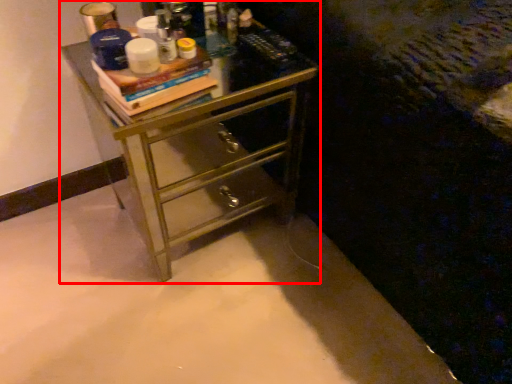
Question: From the image's perspective, considering the relative positions of chest of drawers (annotated by the red box) and book in the image provided, where is chest of drawers (annotated by the red box) located with respect to the staircase?

Choices:
 (A) above
 (B) below

Answer: (B)